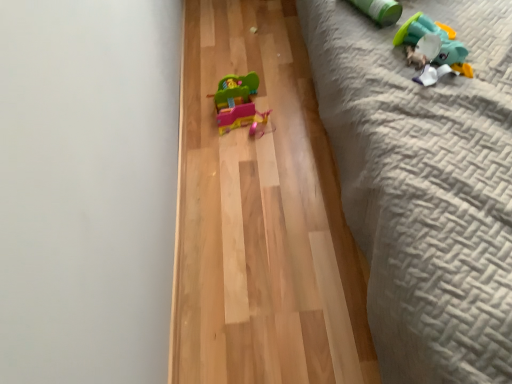
Where is `vacant space to the right of matte plastic toy at center, acting as the first toy starting from the left`? vacant space to the right of matte plastic toy at center, acting as the first toy starting from the left is located at coordinates (295, 105).